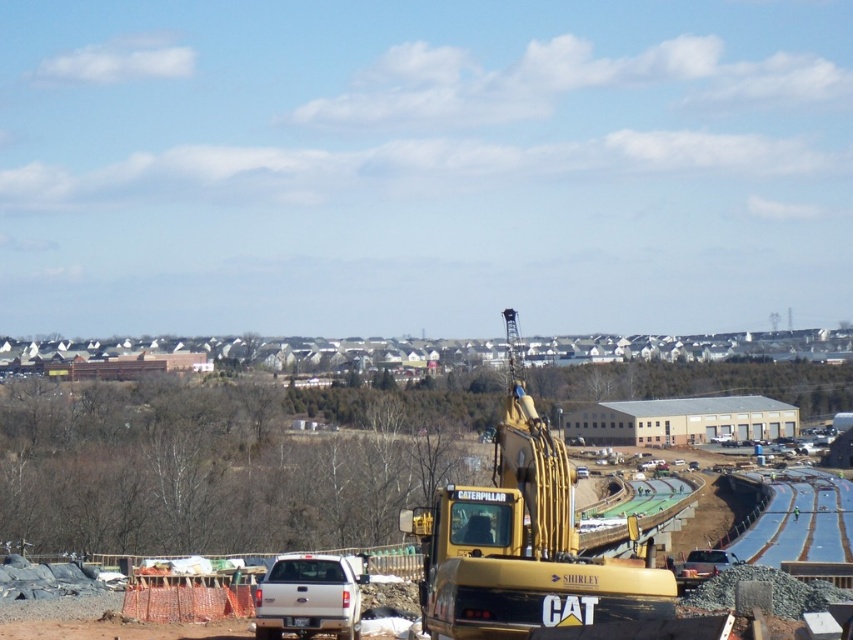
Which is above, yellow metallic excavator at center or metallic silver car at center?

Positioned higher is yellow metallic excavator at center.

This screenshot has height=640, width=853. What do you see at coordinates (521, 541) in the screenshot? I see `yellow metallic excavator at center` at bounding box center [521, 541].

Image resolution: width=853 pixels, height=640 pixels. In order to click on yellow metallic excavator at center in this screenshot , I will do `click(521, 541)`.

Is white matte truck at center positioned in front of metallic silver car at center?

Yes, it is.

Where is `white matte truck at center`? white matte truck at center is located at coordinates (308, 596).

Can you confirm if yellow metallic excavator at center is thinner than white matte truck at center?

No, yellow metallic excavator at center is not thinner than white matte truck at center.

Where is `yellow metallic excavator at center`? yellow metallic excavator at center is located at coordinates (521, 541).

Locate an element on the screen. The image size is (853, 640). yellow metallic excavator at center is located at coordinates (521, 541).